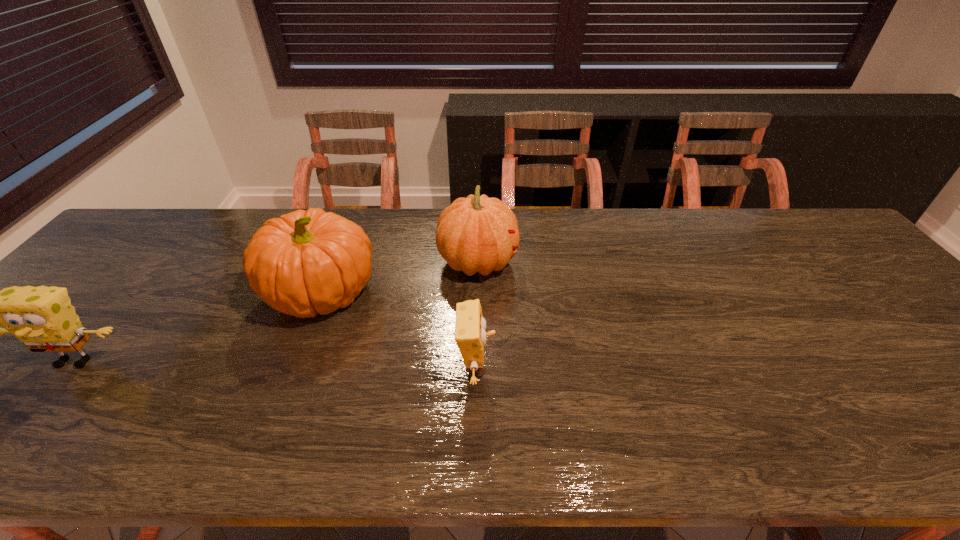
This screenshot has height=540, width=960. What are the coordinates of `object located at the far edge` in the screenshot? It's located at tap(475, 234).

Find the location of a particular element. object that is at the left edge is located at coordinates (43, 318).

Find the location of a particular element. The height and width of the screenshot is (540, 960). vacant space at the far edge of the desktop is located at coordinates (710, 235).

This screenshot has width=960, height=540. In order to click on vacant region at the near edge of the desktop in this screenshot , I will do `click(276, 450)`.

In the image, there is a desktop. Where is `free space at the left edge`? This screenshot has width=960, height=540. free space at the left edge is located at coordinates (38, 362).

Locate an element on the screen. The image size is (960, 540). free space at the right edge is located at coordinates tap(945, 414).

In the image, there is a desktop. What are the coordinates of `vacant area at the far left corner` in the screenshot? It's located at (149, 217).

This screenshot has height=540, width=960. Find the location of `free space at the far right corner of the desktop`. free space at the far right corner of the desktop is located at coordinates (771, 215).

The image size is (960, 540). I want to click on vacant region between the right pumpkin and the second object from left to right, so click(400, 278).

The width and height of the screenshot is (960, 540). In order to click on vacant point located between the third object from right to left and the left sponge in this screenshot , I will do `click(200, 327)`.